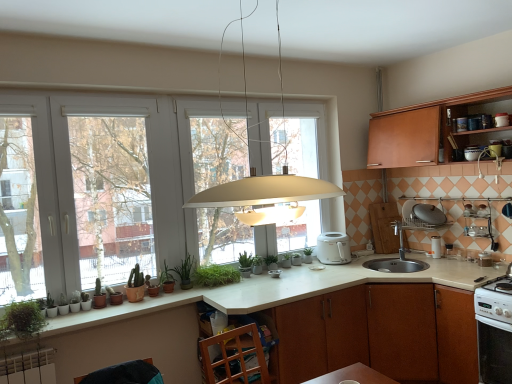
Identify the location of free space on the front side of green matte cactus at lower left, the third plant positioned from the front. The width and height of the screenshot is (512, 384). (91, 305).